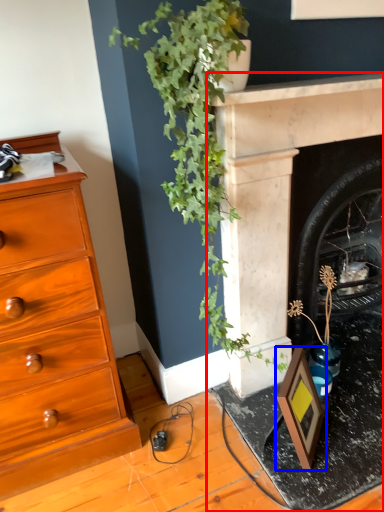
Question: Which of the following is the closest to the observer, fireplace (highlighted by a red box) or picture frame (highlighted by a blue box)?

Choices:
 (A) fireplace
 (B) picture frame

Answer: (A)